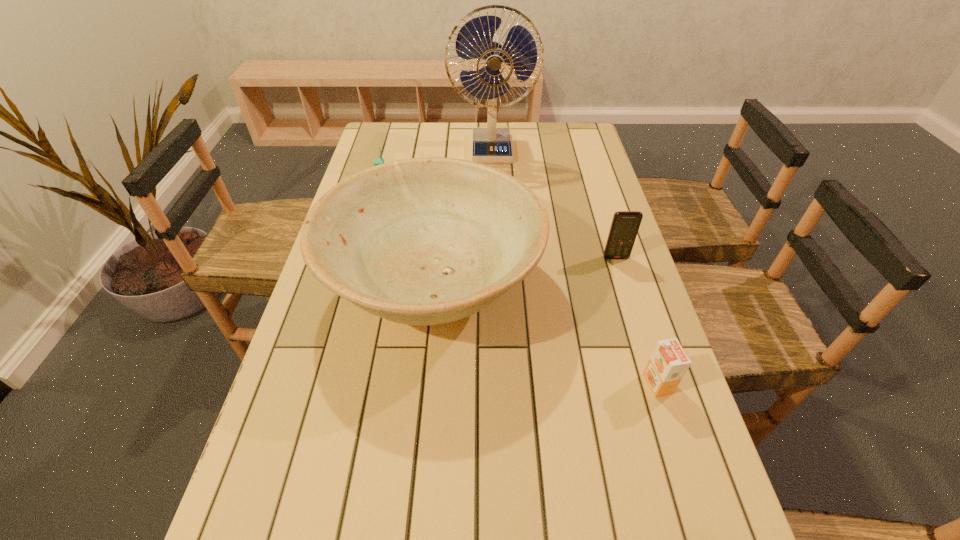
Locate an element on the screen. This screenshot has width=960, height=540. fan is located at coordinates (477, 38).

Identify the location of the tallest object. The image size is (960, 540). (477, 38).

Where is `the fourth shortest object`? The image size is (960, 540). the fourth shortest object is located at coordinates (423, 241).

Locate an element on the screen. the nearer cellular telephone is located at coordinates (625, 224).

Where is `the shorter cellular telephone`? This screenshot has height=540, width=960. the shorter cellular telephone is located at coordinates (377, 161).

The image size is (960, 540). I want to click on the left cellular telephone, so (377, 161).

At what (x,y) coordinates should I click in order to perform the action: click on orange juice. Please return your answer as a coordinate pair (x, y). Looking at the image, I should click on tap(668, 363).

Where is `free location located on the front-facing side of the farthest object`? This screenshot has height=540, width=960. free location located on the front-facing side of the farthest object is located at coordinates (494, 218).

Locate an element on the screen. This screenshot has width=960, height=540. vacant space located on the front of the dish is located at coordinates (410, 529).

At what (x,y) coordinates should I click in order to perform the action: click on vacant space located on the screen of the nearer cellular telephone. Please return your answer as a coordinate pair (x, y). Looking at the image, I should click on (634, 316).